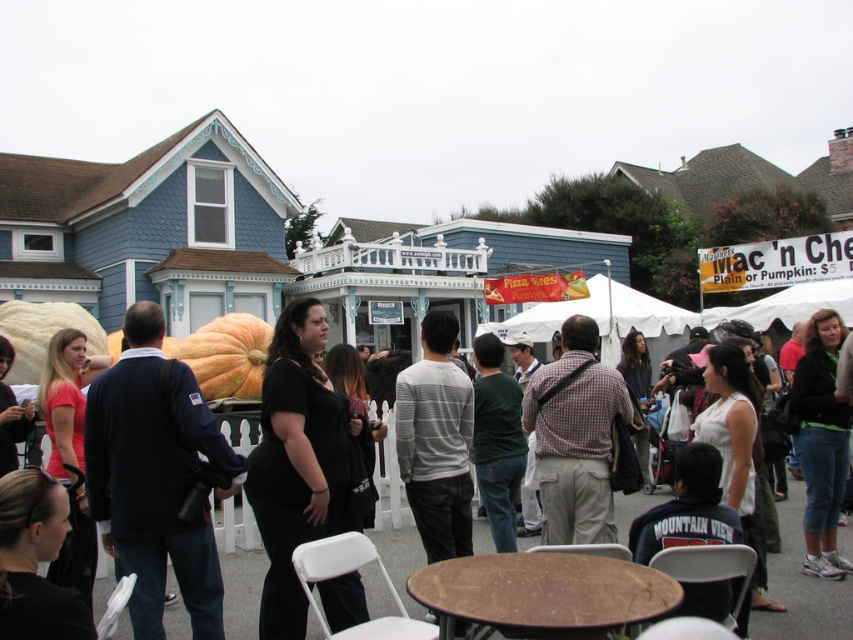
Question: Is black dress at center further to the viewer compared to orange matte pumpkin at center?

Choices:
 (A) yes
 (B) no

Answer: (B)

Question: Which object appears farthest from the camera in this image?

Choices:
 (A) orange matte pumpkin at center
 (B) black dress at center

Answer: (A)

Question: Which of the following is the closest to the observer?

Choices:
 (A) black dress at center
 (B) orange matte pumpkin at center

Answer: (A)

Question: Is black dress at center wider than orange matte pumpkin at center?

Choices:
 (A) no
 (B) yes

Answer: (B)

Question: Is black dress at center below orange matte pumpkin at center?

Choices:
 (A) no
 (B) yes

Answer: (B)

Question: Which point is farther to the camera?

Choices:
 (A) (390, 600)
 (B) (225, 320)

Answer: (B)